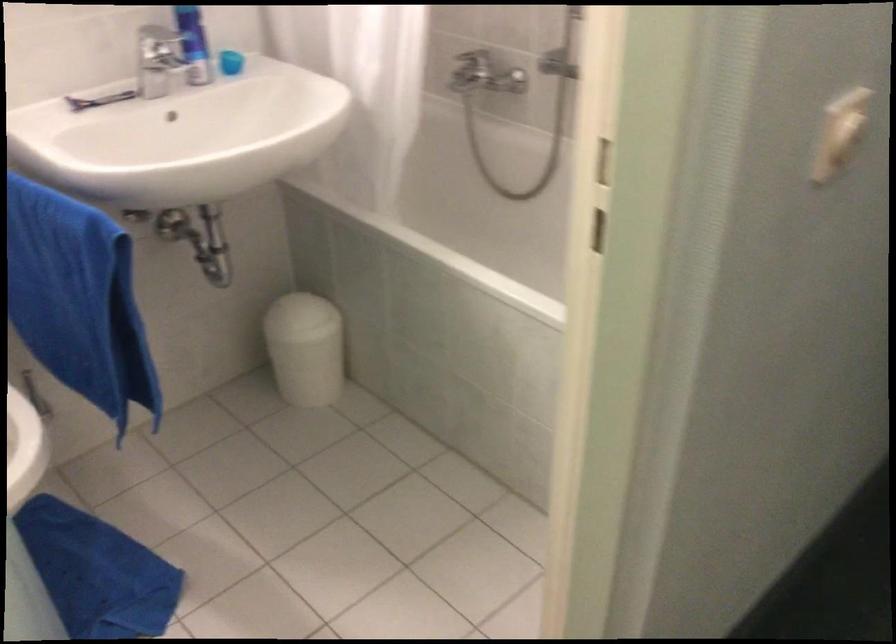
Find where to push the trash can lid. Please return your answer as a coordinate pair (x, y).

(298, 310)